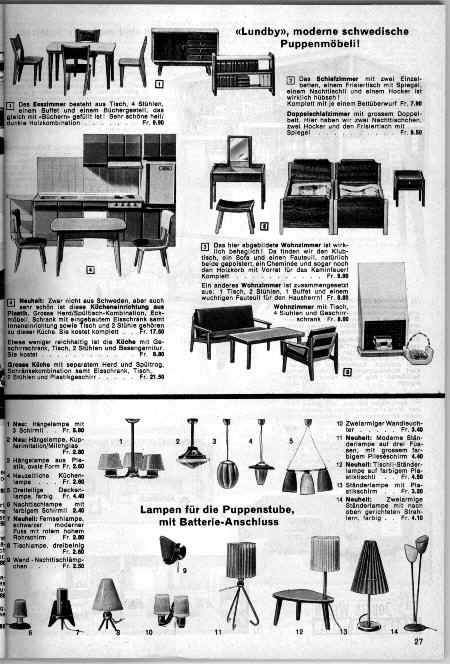
In order to click on refrigerator in this screenshot , I will do `click(159, 187)`.